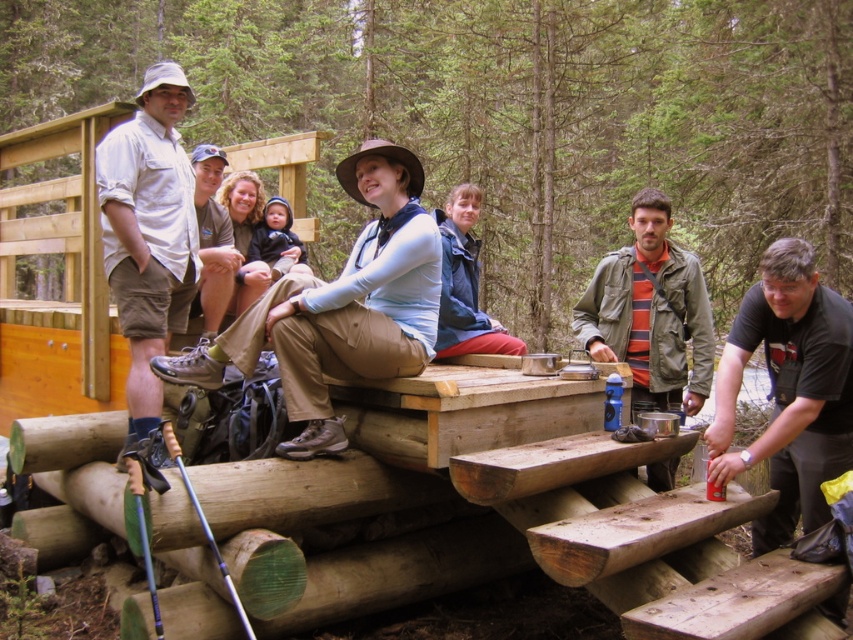
You are a photographer standing at the edge of the forest, looking at the scene. You need to take a photo that includes both the green wood bench at center and the white cotton shirt at left. Based on their positions, which object should you adjust your camera angle to focus on first to ensure both are in frame?

Since the green wood bench at center is to the left of the white cotton shirt at left, you should first focus on the white cotton shirt at left to ensure both are included in the frame.